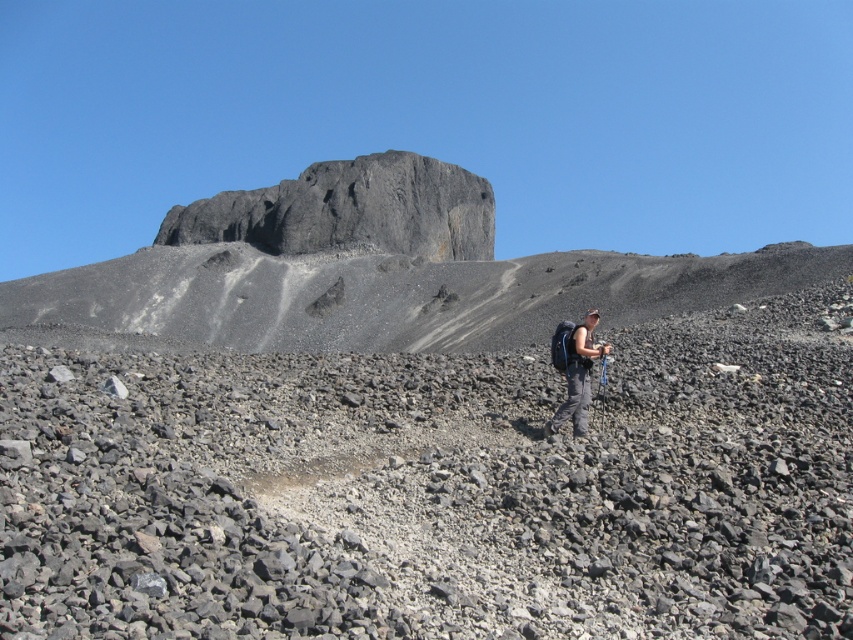
You are a hiker trying to navigate the rocky terrain. You need to reach a specific point marked at coordinates point (376, 269). Which object in the scene corresponds to this location?

The dark gray rock formation at upper center is located at point (376, 269).

You are a hiker trying to navigate the rugged terrain in the image. You need to locate the dark gray rock formation at upper center. According to the coordinates provided, where should you look to find it?

The dark gray rock formation at upper center is located at the 2D coordinates point (376,269).